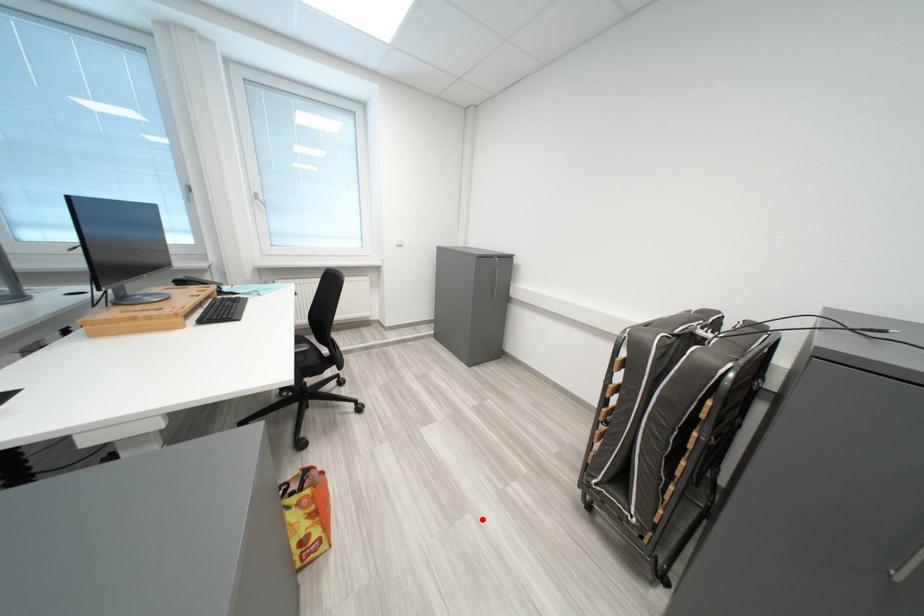
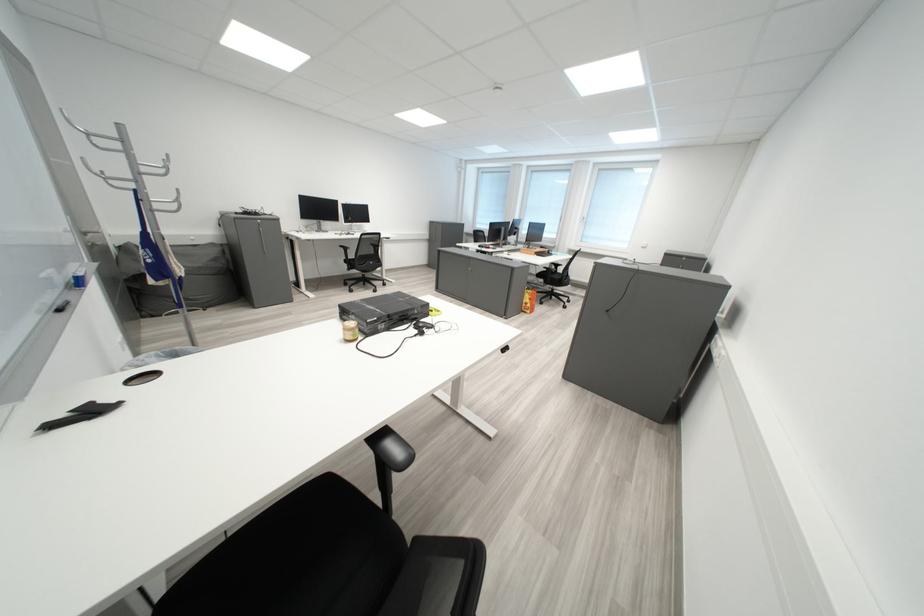
Question: A red point is marked in image1. In image2, is the corresponding 3D point closer to the camera or farther? Reply with the corresponding letter.

Choices:
 (A) The corresponding 3D point is closer.
 (B) The corresponding 3D point is farther.

Answer: (B)